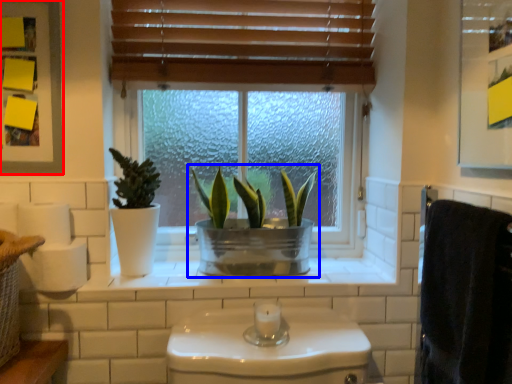
Question: Which object appears farthest to the camera in this image, medicine cabinet (highlighted by a red box) or houseplant (highlighted by a blue box)?

Choices:
 (A) medicine cabinet
 (B) houseplant

Answer: (B)